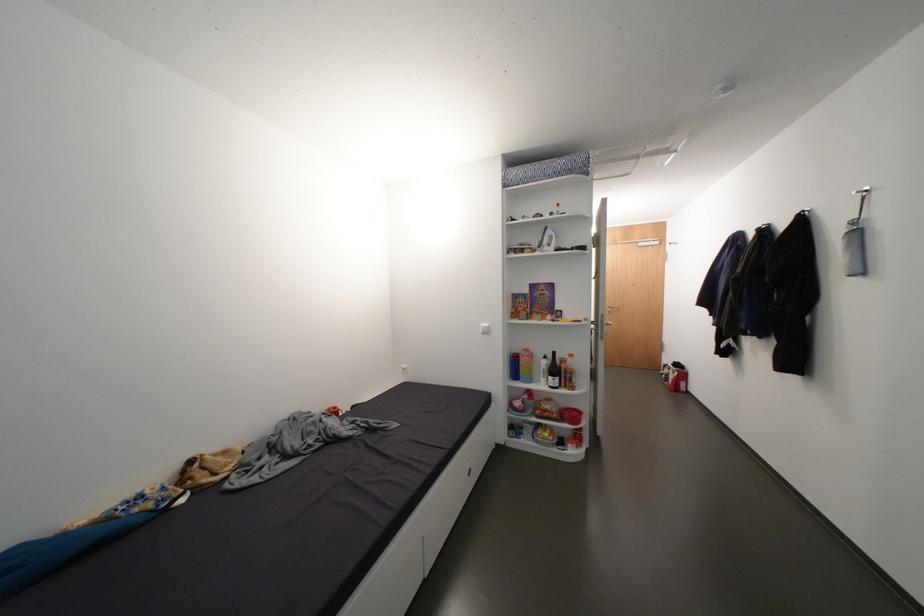
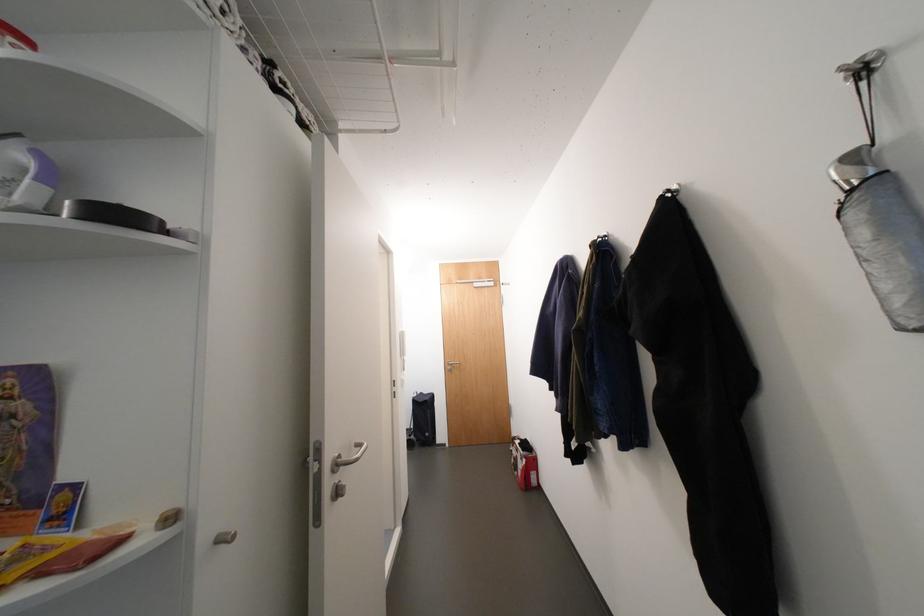
In a continuous first-person perspective shot, in which direction is the camera moving?

The cameraman walked toward right, forward.